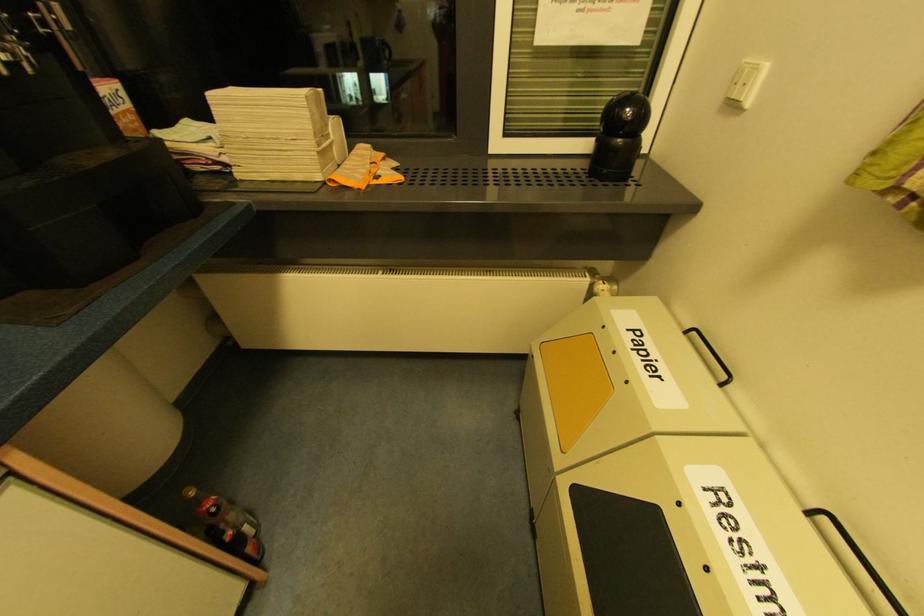
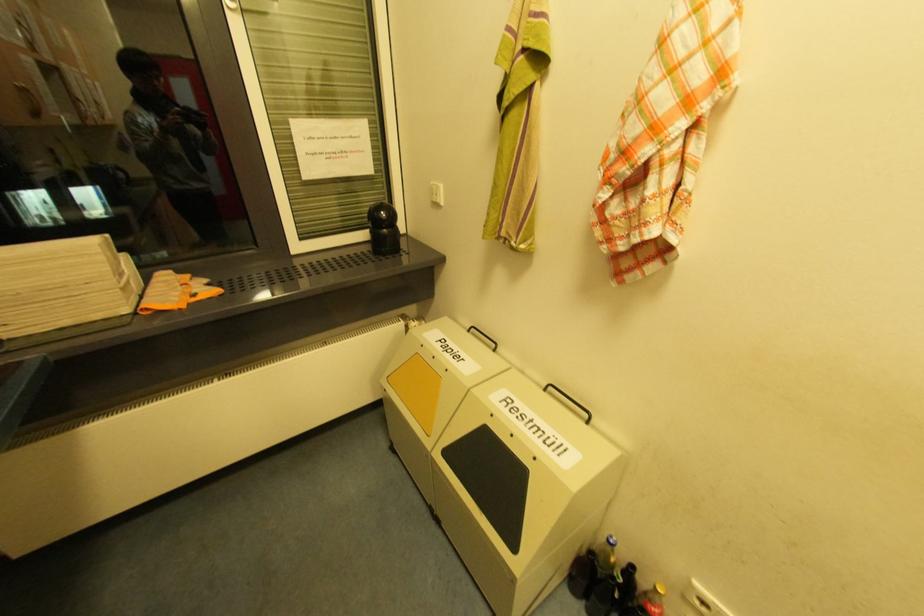
Where in the second image is the point corresponding to point 580,493 from the first image?

(450, 454)